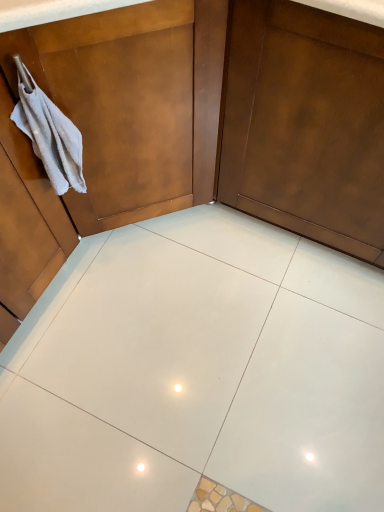
Locate an element on the screen. white glossy tile at center is located at coordinates (154, 341).

What do you see at coordinates (49, 134) in the screenshot?
I see `white cotton hand towel at left` at bounding box center [49, 134].

What is the approximate height of matte brown dresser at upper left?

matte brown dresser at upper left is 33.81 inches tall.

Where is `white glossy tile at center`? white glossy tile at center is located at coordinates (154, 341).

Considering the relative positions of matte brown door at center and white glossy tile at center in the image provided, is matte brown door at center to the left of white glossy tile at center from the viewer's perspective?

In fact, matte brown door at center is to the right of white glossy tile at center.

Is white glossy tile at center at the back of matte brown door at center?

No, matte brown door at center is not facing away from white glossy tile at center.

Is point (275, 64) closer or farther from the camera than point (127, 401)?

Point (275, 64).

Would you say white glossy tile at center is to the left or to the right of matte brown dresser at upper left in the picture?

Based on their positions, white glossy tile at center is located to the right of matte brown dresser at upper left.

The image size is (384, 512). I want to click on ceramic tile behind the matte brown dresser at upper left, so click(x=154, y=341).

Does white glossy tile at center have a lesser width compared to matte brown dresser at upper left?

In fact, white glossy tile at center might be wider than matte brown dresser at upper left.

Does point (197, 270) appear closer or farther from the camera than point (158, 86)?

Clearly, point (197, 270) is more distant from the camera than point (158, 86).

Who is smaller, white glossy tile at center or matte brown door at center?

white glossy tile at center is smaller.

In the scene shown: Between white glossy tile at center and matte brown door at center, which one has more height?

With more height is matte brown door at center.

Looking at this image, which is closer to the camera, (144,295) or (269,66)?

Point (144,295) is positioned farther from the camera compared to point (269,66).

Is white cotton hand towel at left behind matte brown door at center?

Yes, white cotton hand towel at left is further from the camera.

Consider the image. Considering the sizes of white cotton hand towel at left and matte brown door at center in the image, is white cotton hand towel at left wider or thinner than matte brown door at center?

Clearly, white cotton hand towel at left has less width compared to matte brown door at center.

From a real-world perspective, which object stands above the other?

white cotton hand towel at left is physically above.

From the picture: From the image's perspective, is matte brown door at center under matte brown dresser at upper left?

Yes, from the image's perspective, matte brown door at center is beneath matte brown dresser at upper left.

Which of these two, matte brown door at center or matte brown dresser at upper left, is thinner?

matte brown door at center is thinner.

Does matte brown door at center contain matte brown dresser at upper left?

No.

Identify the location of ceramic tile behind the matte brown dresser at upper left. The image size is (384, 512). (154, 341).

Considering the points (109, 130) and (122, 373), which point is in front, point (109, 130) or point (122, 373)?

Positioned in front is point (109, 130).

Considering the sizes of matte brown dresser at upper left and white glossy tile at center in the image, is matte brown dresser at upper left taller or shorter than white glossy tile at center?

Clearly, matte brown dresser at upper left is taller compared to white glossy tile at center.

Does matte brown dresser at upper left lie behind white glossy tile at center?

No, the depth of matte brown dresser at upper left is less than that of white glossy tile at center.

Between matte brown dresser at upper left and white cotton hand towel at left, which one is positioned in front?

matte brown dresser at upper left is in front.

From a real-world perspective, which object stands above the other?

white cotton hand towel at left is physically above.

Can you confirm if matte brown dresser at upper left is positioned to the left of white cotton hand towel at left?

In fact, matte brown dresser at upper left is to the right of white cotton hand towel at left.

Considering the sizes of objects matte brown dresser at upper left and white cotton hand towel at left in the image provided, who is shorter, matte brown dresser at upper left or white cotton hand towel at left?

white cotton hand towel at left.

Identify the location of door on the right of white glossy tile at center. (306, 124).

This screenshot has height=512, width=384. Identify the location of dresser located above the white glossy tile at center (from the image's perspective). (95, 136).

Estimate the real-world distances between objects in this image. Which object is closer to matte brown dresser at upper left, white cotton hand towel at left or white glossy tile at center?

white cotton hand towel at left is closer to matte brown dresser at upper left.

Looking at the image, which one is located further to matte brown dresser at upper left, matte brown door at center or white glossy tile at center?

white glossy tile at center lies further to matte brown dresser at upper left than the other object.

Consider the image. Looking at the image, which one is located further to matte brown door at center, white cotton hand towel at left or matte brown dresser at upper left?

white cotton hand towel at left.

Estimate the real-world distances between objects in this image. Which object is further from matte brown dresser at upper left, white cotton hand towel at left or matte brown door at center?

matte brown door at center.

Based on their spatial positions, is matte brown door at center or white glossy tile at center further from white cotton hand towel at left?

white glossy tile at center is positioned further to the anchor white cotton hand towel at left.

Based on their spatial positions, is white cotton hand towel at left or matte brown dresser at upper left further from white glossy tile at center?

The object further to white glossy tile at center is white cotton hand towel at left.

Estimate the real-world distances between objects in this image. Which object is closer to white glossy tile at center, matte brown door at center or matte brown dresser at upper left?

matte brown dresser at upper left is positioned closer to the anchor white glossy tile at center.

Considering their positions, is white glossy tile at center positioned further to matte brown dresser at upper left than white cotton hand towel at left?

white glossy tile at center.

Where is `hand towel between matte brown dresser at upper left and white glossy tile at center in the up-down direction`? The width and height of the screenshot is (384, 512). hand towel between matte brown dresser at upper left and white glossy tile at center in the up-down direction is located at coordinates (49, 134).

I want to click on hand towel between matte brown door at center and white glossy tile at center from top to bottom, so click(49, 134).

Find the location of a particular element. The width and height of the screenshot is (384, 512). dresser between white cotton hand towel at left and matte brown door at center in the horizontal direction is located at coordinates (95, 136).

Where is `door between matte brown dresser at upper left and white glossy tile at center vertically`? door between matte brown dresser at upper left and white glossy tile at center vertically is located at coordinates (306, 124).